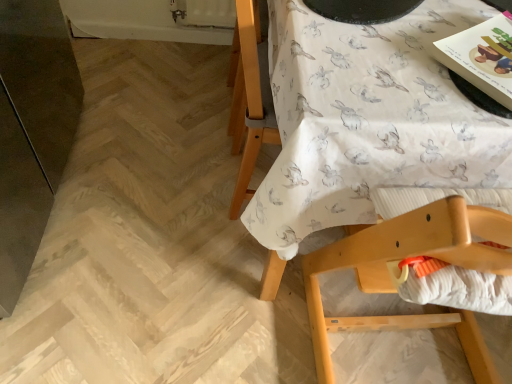
Question: Considering the relative sizes of wooden highchair at upper right and white fabric with rabbit print at upper right in the image provided, is wooden highchair at upper right taller than white fabric with rabbit print at upper right?

Choices:
 (A) no
 (B) yes

Answer: (B)

Question: Is wooden highchair at upper right with white fabric with rabbit print at upper right?

Choices:
 (A) yes
 (B) no

Answer: (B)

Question: Are wooden highchair at upper right and white fabric with rabbit print at upper right far apart?

Choices:
 (A) no
 (B) yes

Answer: (A)

Question: From a real-world perspective, is wooden highchair at upper right located beneath white fabric with rabbit print at upper right?

Choices:
 (A) yes
 (B) no

Answer: (B)

Question: Is wooden highchair at upper right behind white fabric with rabbit print at upper right?

Choices:
 (A) yes
 (B) no

Answer: (B)

Question: In the image, is white textured fabric at lower right positioned in front of or behind matte paper magazine at upper right?

Choices:
 (A) behind
 (B) front

Answer: (B)

Question: From a real-world perspective, is white textured fabric at lower right above or below matte paper magazine at upper right?

Choices:
 (A) below
 (B) above

Answer: (A)

Question: Is point (421, 294) closer or farther from the camera than point (499, 99)?

Choices:
 (A) farther
 (B) closer

Answer: (B)

Question: From the image's perspective, is white textured fabric at lower right above or below matte paper magazine at upper right?

Choices:
 (A) above
 (B) below

Answer: (B)

Question: From a real-world perspective, is wooden highchair at upper right positioned above or below white fabric with rabbit print at upper right?

Choices:
 (A) below
 (B) above

Answer: (B)

Question: From the image's perspective, is wooden highchair at upper right positioned above or below white fabric with rabbit print at upper right?

Choices:
 (A) above
 (B) below

Answer: (B)

Question: Which is correct: wooden highchair at upper right is inside white fabric with rabbit print at upper right, or outside of it?

Choices:
 (A) outside
 (B) inside

Answer: (B)

Question: Considering the positions of wooden highchair at upper right and white fabric with rabbit print at upper right in the image, is wooden highchair at upper right bigger or smaller than white fabric with rabbit print at upper right?

Choices:
 (A) big
 (B) small

Answer: (B)

Question: Would you say white fabric with rabbit print at upper right is inside or outside white textured fabric at lower right?

Choices:
 (A) inside
 (B) outside

Answer: (B)

Question: From the image's perspective, is white fabric with rabbit print at upper right located above or below white textured fabric at lower right?

Choices:
 (A) below
 (B) above

Answer: (B)